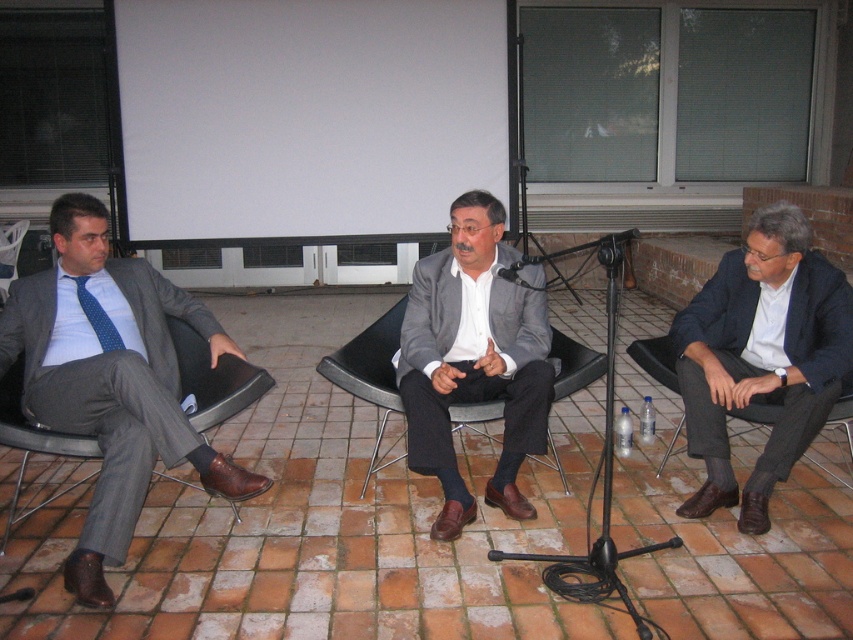
You are organizing a formal event and need to ensure that the attire of the participants adheres to specific size requirements. The rule states that the width of the blazer must be at least twice the width of the tie. Given the information provided, does the matte gray blazer at center meet the requirement compared to the blue dotted tie at left?

The matte gray blazer at center has a larger width than the blue dotted tie at left, but the exact measurements are not provided. Therefore, it cannot be confirmed if the blazer meets the requirement of being at least twice the width of the tie.

Looking at this image, you are standing at the origin point of the coordinate system. The origin is at the bottom left corner of the image. The coordinate system has the x axis going to the right and the y axis going up. The image has a width of 1 unit and a height of 1 unit. You want to walk to the matte gray suit at left. In which direction should you move first?

Since the matte gray suit at left is located at coordinate point 0.597 on the x axis and 0.131 on the y axis, you should first move to the right along the x axis because the x coordinate is greater than 0.5, which is halfway across the image. Once you reach x 0.597, then move up slightly along the y axis to 0.131.